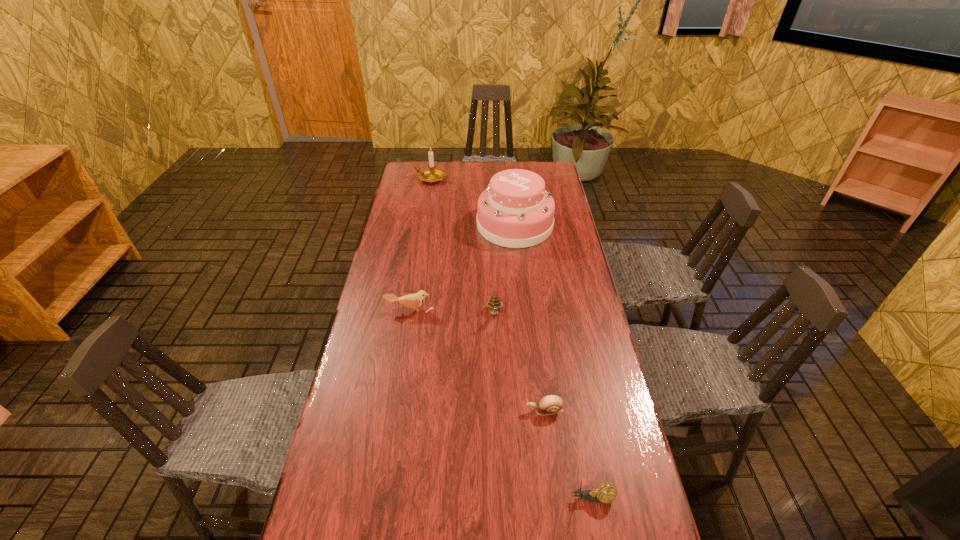
This screenshot has width=960, height=540. Identify the location of free point between the bird and the farthest escargot. (452, 312).

Find the location of `free space between the tallest object and the tallest escargot`. free space between the tallest object and the tallest escargot is located at coordinates (505, 269).

At what (x,y) coordinates should I click in order to perform the action: click on unoccupied area between the nearest object and the tallest object. Please return your answer as a coordinate pair (x, y). The image size is (960, 540). Looking at the image, I should click on (554, 362).

Identify which object is the fourth nearest to the fifth shortest object. Please provide its 2D coordinates. Your answer should be formatted as a tuple, i.e. [(x, y)], where the tuple contains the x and y coordinates of a point satisfying the conditions above.

[(551, 404)]

Where is `object that is the closest one to the fourth tallest object`? object that is the closest one to the fourth tallest object is located at coordinates (494, 304).

Identify which escargot is located as the third nearest to the tallest object. Please provide its 2D coordinates. Your answer should be formatted as a tuple, i.e. [(x, y)], where the tuple contains the x and y coordinates of a point satisfying the conditions above.

[(606, 492)]

Identify which escargot is the second closest to the fifth farthest object. Please provide its 2D coordinates. Your answer should be formatted as a tuple, i.e. [(x, y)], where the tuple contains the x and y coordinates of a point satisfying the conditions above.

[(494, 304)]